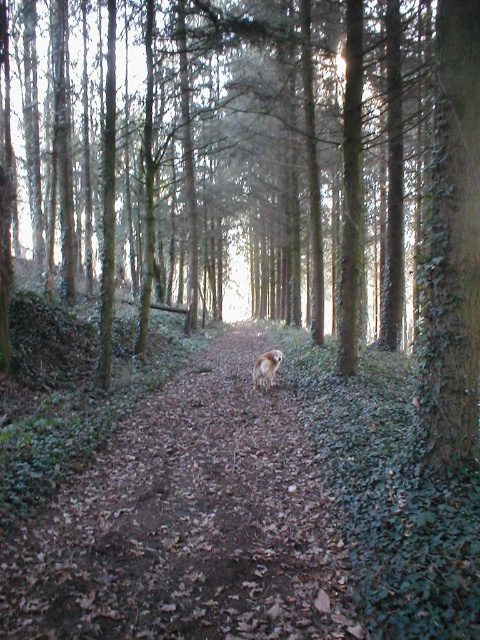
You are a hiker who wants to take a photo of the furry golden dog at center while standing on the brown leafy forest path at center. Can you fit both the dog and the path in the same photo without moving either? Explain why or why not.

The brown leafy forest path at center and furry golden dog at center are 9.03 feet apart from each other. Since the distance between them is significant, it is possible to capture both in a single photo without moving either, provided the camera has a wide enough lens or the hiker positions themselves appropriately to include both subjects in the frame.

You are a hiker walking along the brown leafy forest path at center and the furry golden dog at center. Which object is located to the right of the other?

The furry golden dog at center is positioned to the right of the brown leafy forest path at center.